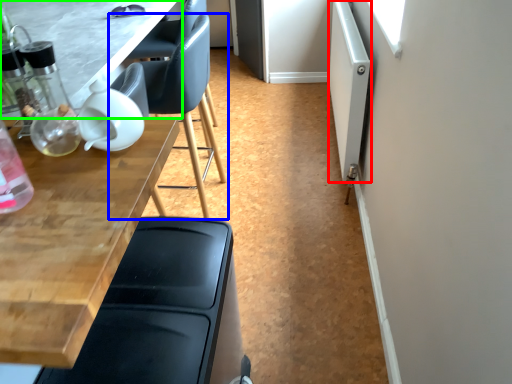
Question: Considering the real-world distances, which object is farthest from screen door (highlighted by a red box)? chair (highlighted by a blue box) or table (highlighted by a green box)?

Choices:
 (A) chair
 (B) table

Answer: (B)